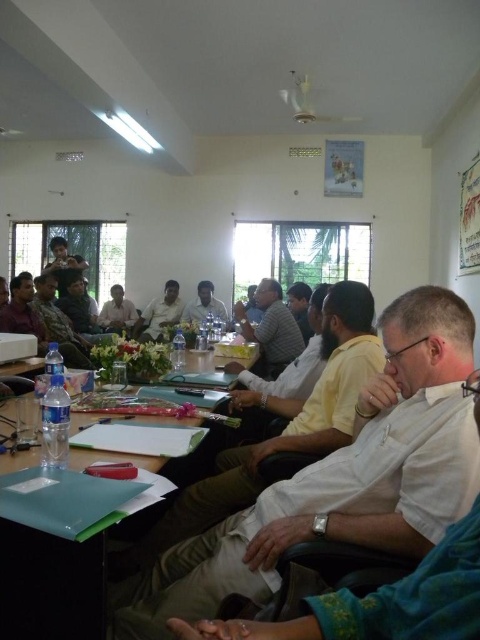
In the scene shown: Does white cotton shirt at center appear on the right side of matte gray shirt at center?

Incorrect, white cotton shirt at center is not on the right side of matte gray shirt at center.

Is point (295, 508) positioned after point (276, 324)?

No, it is not.

Does point (317, 520) lie in front of point (269, 339)?

Yes.

The width and height of the screenshot is (480, 640). I want to click on white cotton shirt at center, so click(x=344, y=476).

From the picture: Is matte gray shirt at center further to the viewer compared to camouflage uniform at center?

No, it is in front of camouflage uniform at center.

I want to click on matte gray shirt at center, so click(x=272, y=328).

Who is positioned more to the right, green plastic folder at center or matte white shirt at center?

green plastic folder at center is more to the right.

Which is behind, point (57, 497) or point (116, 320)?

Positioned behind is point (116, 320).

Identify the location of green plastic folder at center. (56, 554).